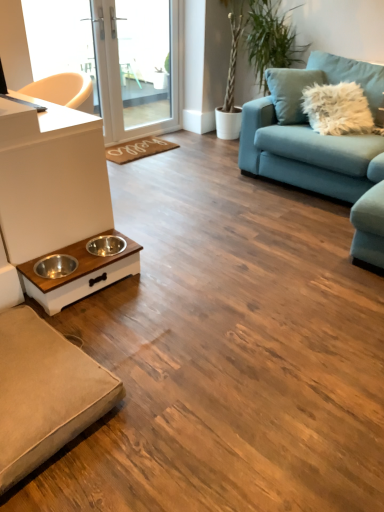
Where is `free space to the back side of beige fabric studio couch at lower left, which appears as the 1th studio couch when viewed from the front`? The width and height of the screenshot is (384, 512). free space to the back side of beige fabric studio couch at lower left, which appears as the 1th studio couch when viewed from the front is located at coordinates (118, 310).